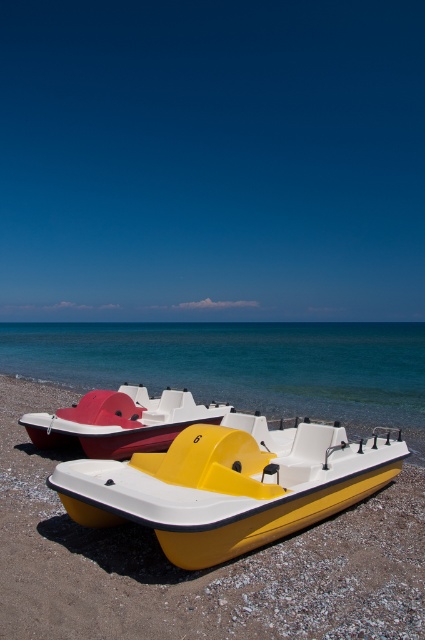
Question: Which object appears closest to the camera in this image?

Choices:
 (A) blue water at center
 (B) matte plastic paddle boat at lower left

Answer: (B)

Question: Estimate the real-world distances between objects in this image. Which object is closer to the yellow matte pedal boat at center?

Choices:
 (A) blue water at center
 (B) matte plastic paddle boat at lower left

Answer: (B)

Question: Does yellow matte pedal boat at center appear over matte plastic paddle boat at lower left?

Choices:
 (A) no
 (B) yes

Answer: (A)

Question: Is blue water at center below matte plastic paddle boat at lower left?

Choices:
 (A) no
 (B) yes

Answer: (A)

Question: Can you confirm if yellow matte pedal boat at center is positioned to the left of matte plastic paddle boat at lower left?

Choices:
 (A) no
 (B) yes

Answer: (A)

Question: Which point appears farthest from the camera in this image?

Choices:
 (A) (161, 522)
 (B) (91, 417)

Answer: (B)